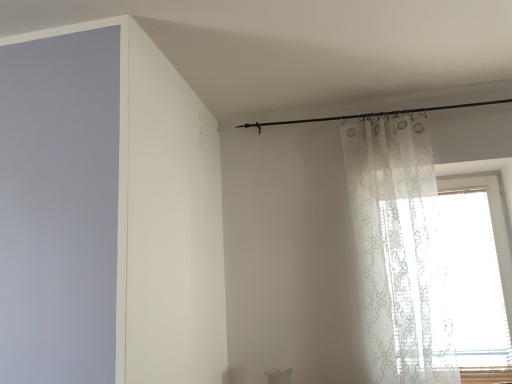
Question: From the image's perspective, is sheer white curtain at right below translucent white curtain at upper right?

Choices:
 (A) no
 (B) yes

Answer: (B)

Question: Considering the relative sizes of sheer white curtain at right and translucent white curtain at upper right in the image provided, is sheer white curtain at right taller than translucent white curtain at upper right?

Choices:
 (A) yes
 (B) no

Answer: (B)

Question: Is the depth of sheer white curtain at right greater than that of translucent white curtain at upper right?

Choices:
 (A) no
 (B) yes

Answer: (B)

Question: Is translucent white curtain at upper right surrounded by sheer white curtain at right?

Choices:
 (A) no
 (B) yes

Answer: (A)

Question: Is sheer white curtain at right facing away from translucent white curtain at upper right?

Choices:
 (A) yes
 (B) no

Answer: (A)

Question: Is sheer white curtain at right beside translucent white curtain at upper right?

Choices:
 (A) no
 (B) yes

Answer: (A)

Question: Does translucent white curtain at upper right turn towards sheer white curtain at right?

Choices:
 (A) yes
 (B) no

Answer: (B)

Question: Is translucent white curtain at upper right looking in the opposite direction of sheer white curtain at right?

Choices:
 (A) no
 (B) yes

Answer: (B)

Question: Is sheer white curtain at right located within translucent white curtain at upper right?

Choices:
 (A) yes
 (B) no

Answer: (B)

Question: Is translucent white curtain at upper right bigger than sheer white curtain at right?

Choices:
 (A) no
 (B) yes

Answer: (A)

Question: Would you say translucent white curtain at upper right is a long distance from sheer white curtain at right?

Choices:
 (A) no
 (B) yes

Answer: (A)

Question: Is translucent white curtain at upper right thinner than sheer white curtain at right?

Choices:
 (A) yes
 (B) no

Answer: (A)

Question: Considering the positions of translucent white curtain at upper right and sheer white curtain at right in the image, is translucent white curtain at upper right bigger or smaller than sheer white curtain at right?

Choices:
 (A) big
 (B) small

Answer: (B)